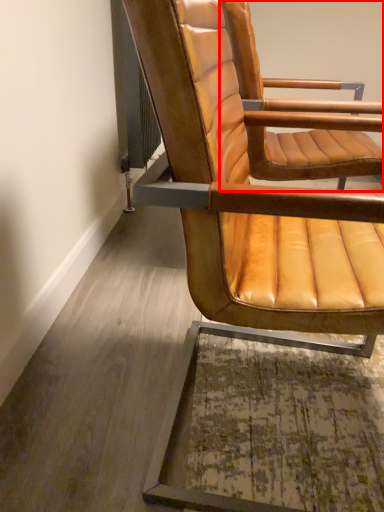
Question: Where is chair (annotated by the red box) located in relation to chair in the image?

Choices:
 (A) right
 (B) left

Answer: (A)